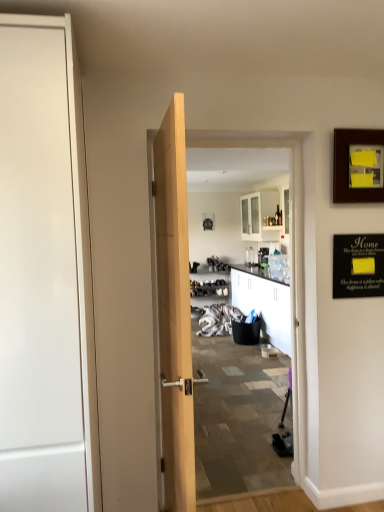
Question: Does wooden picture frame at center, acting as the 1th picture frame starting from the back, appear on the left side of white glossy door at left?

Choices:
 (A) yes
 (B) no

Answer: (B)

Question: Is wooden picture frame at center, placed as the 1th picture frame when sorted from left to right, thinner than white glossy door at left?

Choices:
 (A) no
 (B) yes

Answer: (B)

Question: Is wooden picture frame at center, acting as the 1th picture frame starting from the back, located outside white glossy door at left?

Choices:
 (A) yes
 (B) no

Answer: (A)

Question: From the image's perspective, is wooden picture frame at center, the 2th picture frame from the front, on white glossy door at left?

Choices:
 (A) yes
 (B) no

Answer: (A)

Question: Is white glossy door at left at the back of wooden picture frame at center, placed as the 1th picture frame when sorted from left to right?

Choices:
 (A) yes
 (B) no

Answer: (B)

Question: Is wooden picture frame at center, acting as the 2th picture frame starting from the right, taller or shorter than wooden picture frame at upper right, the first picture frame in the front-to-back sequence?

Choices:
 (A) tall
 (B) short

Answer: (B)

Question: Based on their sizes in the image, would you say wooden picture frame at center, acting as the 2th picture frame starting from the right, is bigger or smaller than wooden picture frame at upper right, the first picture frame in the front-to-back sequence?

Choices:
 (A) small
 (B) big

Answer: (A)

Question: In terms of width, does wooden picture frame at center, acting as the 1th picture frame starting from the back, look wider or thinner when compared to wooden picture frame at upper right, placed as the 1th picture frame when sorted from right to left?

Choices:
 (A) wide
 (B) thin

Answer: (A)

Question: Is wooden picture frame at center, acting as the 2th picture frame starting from the right, in front of or behind wooden picture frame at upper right, the second picture frame positioned from the left, in the image?

Choices:
 (A) front
 (B) behind

Answer: (B)

Question: Visually, is white glossy door at left positioned to the left or to the right of wooden picture frame at upper right, placed as the 1th picture frame when sorted from right to left?

Choices:
 (A) right
 (B) left

Answer: (B)

Question: From their relative heights in the image, would you say white glossy door at left is taller or shorter than wooden picture frame at upper right, the first picture frame in the front-to-back sequence?

Choices:
 (A) tall
 (B) short

Answer: (A)

Question: Is white glossy door at left wider or thinner than wooden picture frame at upper right, the second picture frame when ordered from back to front?

Choices:
 (A) wide
 (B) thin

Answer: (A)

Question: Relative to wooden picture frame at upper right, the first picture frame in the front-to-back sequence, is white glossy door at left in front or behind?

Choices:
 (A) front
 (B) behind

Answer: (A)

Question: Looking at their shapes, would you say black matte bulletin board at upper right is wider or thinner than white glossy door at left?

Choices:
 (A) thin
 (B) wide

Answer: (A)

Question: From their relative heights in the image, would you say black matte bulletin board at upper right is taller or shorter than white glossy door at left?

Choices:
 (A) tall
 (B) short

Answer: (B)